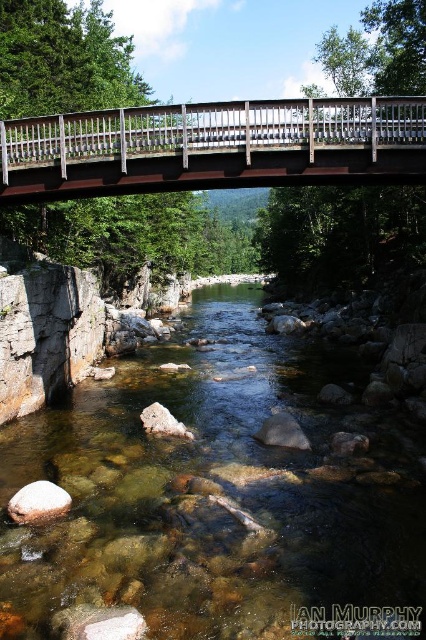
Based on the photo, you are standing on the wooden bridge and want to see the clear stone stream at center. In which direction should you look relative to your position on the bridge?

The clear stone stream at center is located directly below the bridge at point coordinates, so you should look downward to see it.

You are standing on the riverbank and want to cross the river using the brown wooden bridge at center. However, you notice a white smooth rock at lower left near the water. Which direction should you walk from the rock to reach the bridge?

You should walk to the right from the white smooth rock at lower left to reach the brown wooden bridge at center since the bridge is positioned to the right of the rock.

You are a hiker crossing the brown wooden bridge at center and want to know if you can see the clear stone stream at center from the middle of the bridge. Can you see it?

The clear stone stream at center is shorter than brown wooden bridge at center, so yes, you can see the clear stone stream at center from the middle of the bridge because it is lower in height.